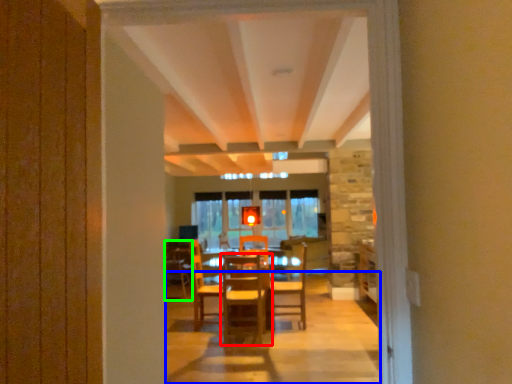
Question: Considering the real-world distances, which object is farthest from chair (highlighted by a red box)? path (highlighted by a blue box) or armchair (highlighted by a green box)?

Choices:
 (A) path
 (B) armchair

Answer: (B)